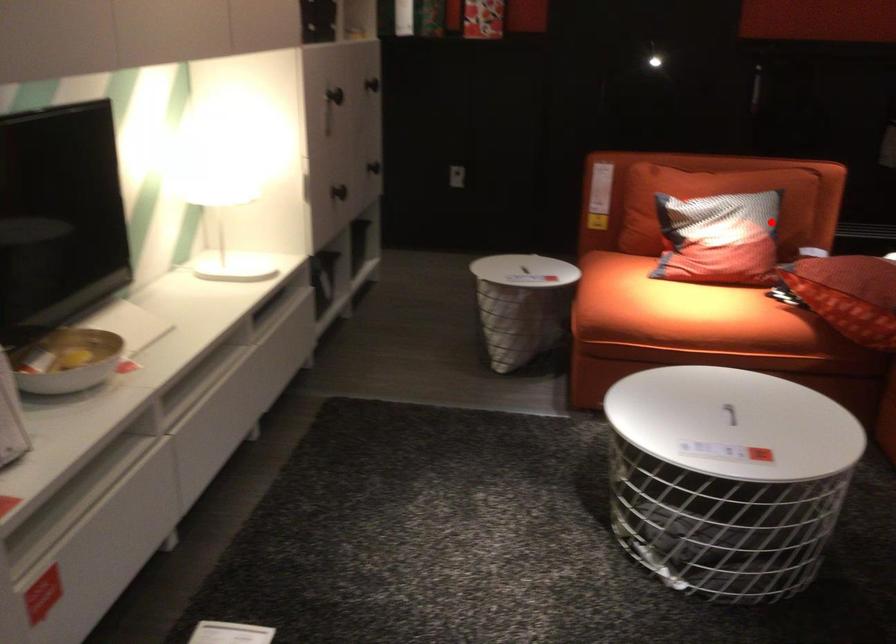
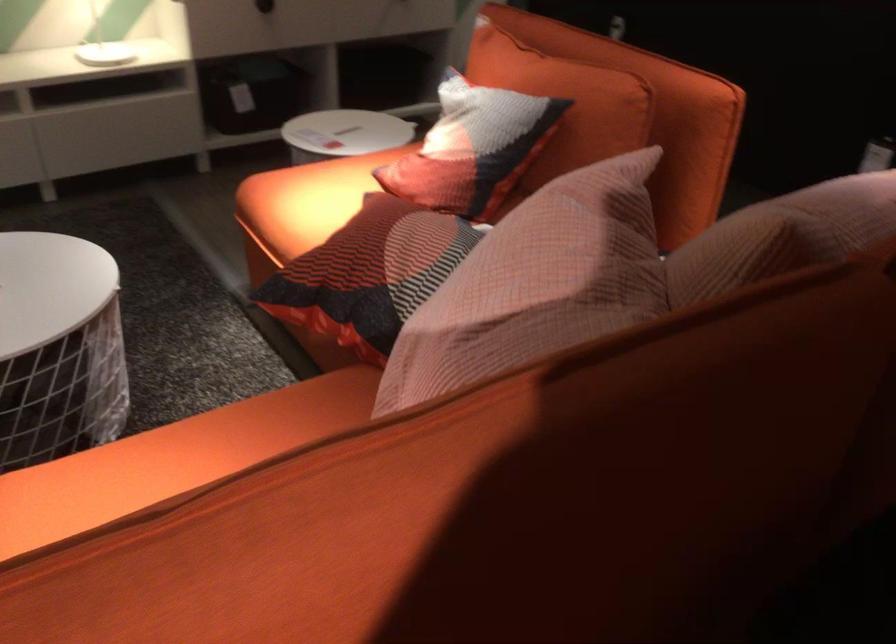
Where in the second image is the point corresponding to the highlighted location from the first image?

(472, 147)